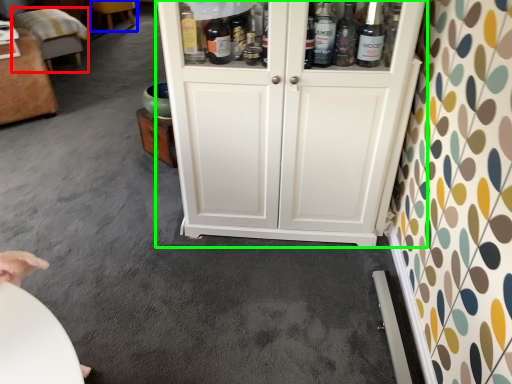
Question: Which is nearer to the furniture (highlighted by a red box)? furniture (highlighted by a blue box) or cupboard (highlighted by a green box).

Choices:
 (A) furniture
 (B) cupboard

Answer: (A)